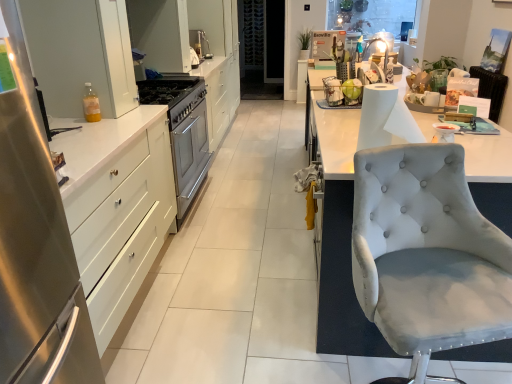
Question: Is satin silver sink at center at the back of light gray fabric chair at right?

Choices:
 (A) yes
 (B) no

Answer: (B)

Question: Would you say light gray fabric chair at right contains satin silver sink at center?

Choices:
 (A) no
 (B) yes

Answer: (A)

Question: Does light gray fabric chair at right have a greater height compared to satin silver sink at center?

Choices:
 (A) yes
 (B) no

Answer: (A)

Question: Can you confirm if light gray fabric chair at right is positioned to the right of satin silver sink at center?

Choices:
 (A) no
 (B) yes

Answer: (B)

Question: Is light gray fabric chair at right wider than satin silver sink at center?

Choices:
 (A) no
 (B) yes

Answer: (B)

Question: Is white paper at right spatially inside satin silver gas stove at center, or outside of it?

Choices:
 (A) outside
 (B) inside

Answer: (A)

Question: Is white paper at right in front of or behind satin silver gas stove at center in the image?

Choices:
 (A) behind
 (B) front

Answer: (B)

Question: Is point (391, 132) positioned closer to the camera than point (154, 84)?

Choices:
 (A) farther
 (B) closer

Answer: (B)

Question: Considering the positions of white paper at right and satin silver gas stove at center in the image, is white paper at right taller or shorter than satin silver gas stove at center?

Choices:
 (A) short
 (B) tall

Answer: (B)

Question: Based on their sizes in the image, would you say light gray fabric chair at right is bigger or smaller than white glossy cabinet at upper left, the second cabinetry in the back-to-front sequence?

Choices:
 (A) small
 (B) big

Answer: (B)

Question: From the image's perspective, is light gray fabric chair at right located above or below white glossy cabinet at upper left, the 2th cabinetry in the top-to-bottom sequence?

Choices:
 (A) below
 (B) above

Answer: (A)

Question: In terms of width, does light gray fabric chair at right look wider or thinner when compared to white glossy cabinet at upper left, the 2th cabinetry in the top-to-bottom sequence?

Choices:
 (A) thin
 (B) wide

Answer: (B)

Question: From a real-world perspective, is light gray fabric chair at right above or below white glossy cabinet at upper left, the second cabinetry in the bottom-to-top sequence?

Choices:
 (A) above
 (B) below

Answer: (B)

Question: Is satin silver sink at center in front of or behind light gray fabric chair at right in the image?

Choices:
 (A) behind
 (B) front

Answer: (A)

Question: From a real-world perspective, is satin silver sink at center physically located above or below light gray fabric chair at right?

Choices:
 (A) above
 (B) below

Answer: (B)